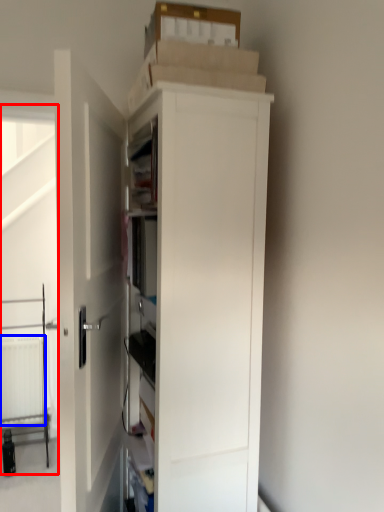
Question: Which object is closer to the camera taking this photo, screen door (highlighted by a red box) or radiator (highlighted by a blue box)?

Choices:
 (A) screen door
 (B) radiator

Answer: (A)